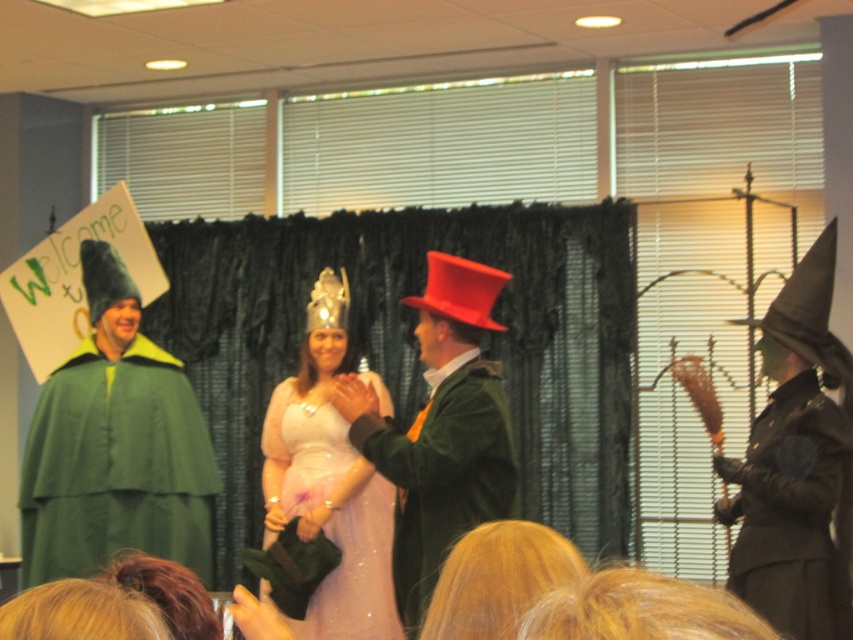
Which is behind, point (329, 307) or point (827, 512)?

The point (329, 307) is more distant.

Does pale pink satin dress at center have a lesser width compared to black matte robe at right?

No, pale pink satin dress at center is not thinner than black matte robe at right.

Who is more distant from viewer, (264, 540) or (799, 515)?

The point (264, 540) is more distant.

At what (x,y) coordinates should I click in order to perform the action: click on pale pink satin dress at center. Please return your answer as a coordinate pair (x, y). Image resolution: width=853 pixels, height=640 pixels. Looking at the image, I should click on (329, 481).

Which is behind, point (112, 509) or point (419, 589)?

The point (112, 509) is behind.

Which of these two, matte green cape at left or velvet green coat at center, stands shorter?

Standing shorter between the two is velvet green coat at center.

In order to click on matte green cape at left in this screenshot , I will do `click(115, 445)`.

The image size is (853, 640). I want to click on velvet green coat at center, so click(x=440, y=432).

Is velvet green coat at center bigger than black matte robe at right?

Yes.

Does point (439, 560) come closer to viewer compared to point (757, 586)?

Yes, point (439, 560) is closer to viewer.

The height and width of the screenshot is (640, 853). In order to click on velvet green coat at center in this screenshot , I will do `click(440, 432)`.